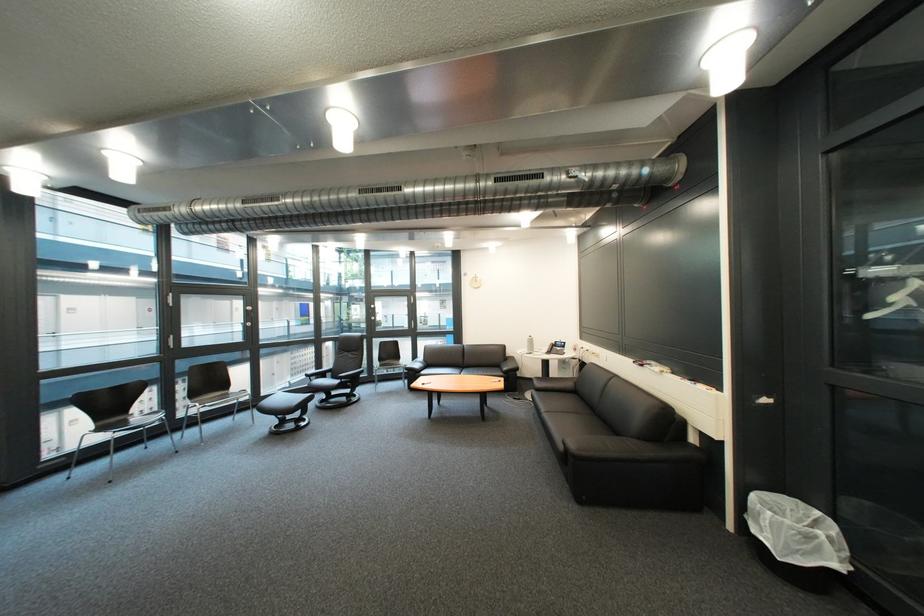
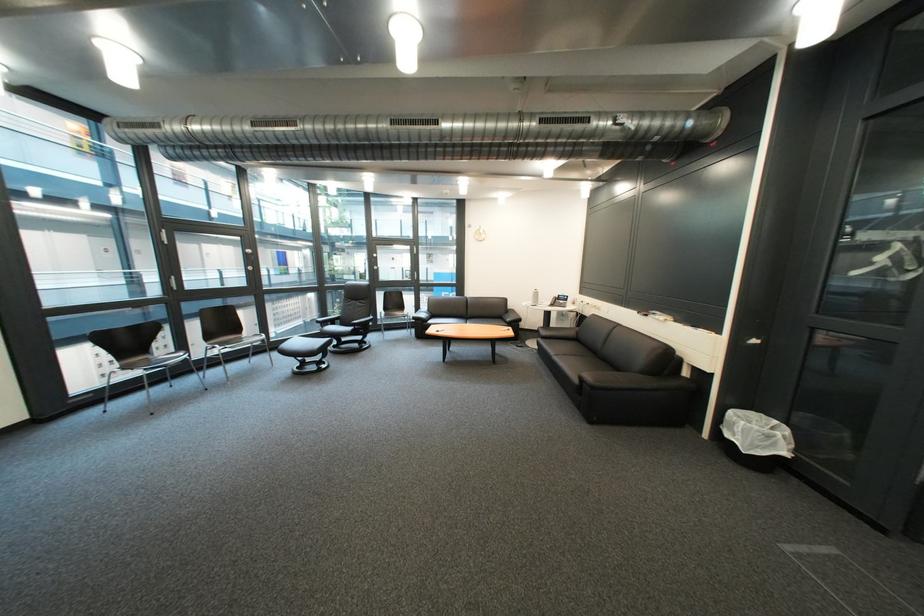
Find the pixel in the second image that matches pixel 211 406 in the first image.

(229, 347)